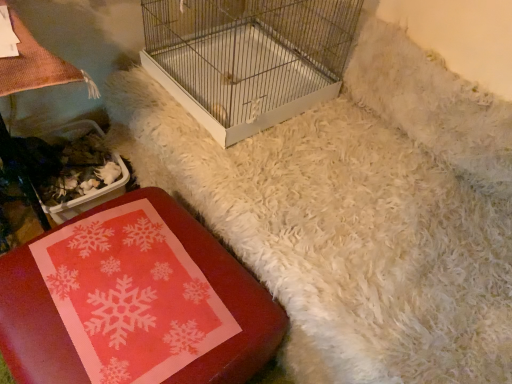
Question: From a real-world perspective, relative to matte red tray at lower left, is white matte birdcage at center vertically above or below?

Choices:
 (A) below
 (B) above

Answer: (B)

Question: Considering their positions, is white matte birdcage at center located in front of or behind matte red tray at lower left?

Choices:
 (A) behind
 (B) front

Answer: (A)

Question: Looking at their shapes, would you say white matte birdcage at center is wider or thinner than matte red tray at lower left?

Choices:
 (A) thin
 (B) wide

Answer: (B)

Question: Is matte red tray at lower left to the left or to the right of white matte birdcage at center in the image?

Choices:
 (A) right
 (B) left

Answer: (B)

Question: Considering the positions of point (198, 375) and point (150, 36), is point (198, 375) closer or farther from the camera than point (150, 36)?

Choices:
 (A) closer
 (B) farther

Answer: (A)

Question: Is matte red tray at lower left inside the boundaries of white matte birdcage at center, or outside?

Choices:
 (A) outside
 (B) inside

Answer: (A)

Question: From their relative heights in the image, would you say matte red tray at lower left is taller or shorter than white matte birdcage at center?

Choices:
 (A) tall
 (B) short

Answer: (B)